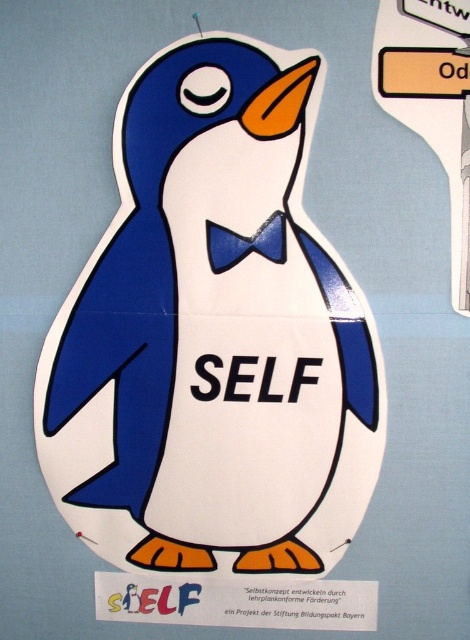
Based on the photo, you are a photographer trying to capture the penguin character in the image. You notice two points marked on the penguin. Which point, point (445, 144) or point (234, 241), appears closer to your camera lens?

Point (445, 144) is closer to the camera than point (234, 241), so it appears closer to the camera lens.

In the scene shown: You are designing a poster and need to place a matte paper penguin at center and a blue fabric bow tie at center. According to the image, which object should be placed in front to create a layered effect?

The matte paper penguin at center should be placed in front of the blue fabric bow tie at center to create a layered effect since it is closer to the viewer.

You are designing a poster and need to ensure the matte paper penguin at center and the blue fabric bow tie at center are arranged correctly. According to the image, which object should be placed higher?

The blue fabric bow tie at center should be placed higher because the matte paper penguin at center is positioned under it.